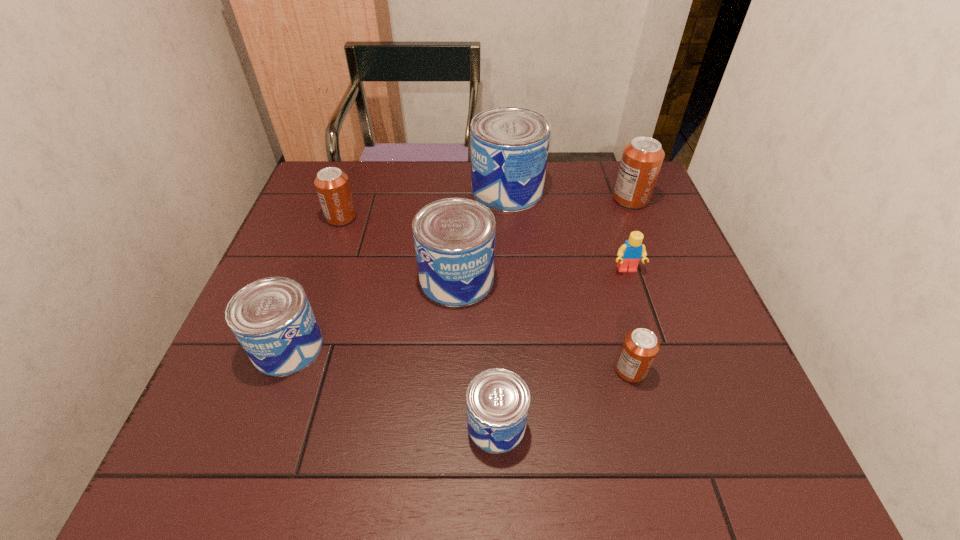
In order to click on the farthest blue can in this screenshot , I will do `click(509, 145)`.

This screenshot has height=540, width=960. I want to click on the tallest can, so click(x=509, y=145).

Identify the location of the rightmost orange can. (641, 161).

Locate an element on the screen. The image size is (960, 540). the rightmost can is located at coordinates (641, 161).

Where is `the second farthest blue can`? The image size is (960, 540). the second farthest blue can is located at coordinates 454,238.

I want to click on the third smallest blue can, so click(454, 238).

This screenshot has height=540, width=960. In order to click on the second smallest orange can in this screenshot , I will do `click(332, 185)`.

Find the location of a particular element. The width and height of the screenshot is (960, 540). the second smallest blue can is located at coordinates (272, 319).

The image size is (960, 540). In order to click on the third farthest blue can in this screenshot , I will do `click(272, 319)`.

Image resolution: width=960 pixels, height=540 pixels. In order to click on yellow Lego in this screenshot , I will do `click(629, 254)`.